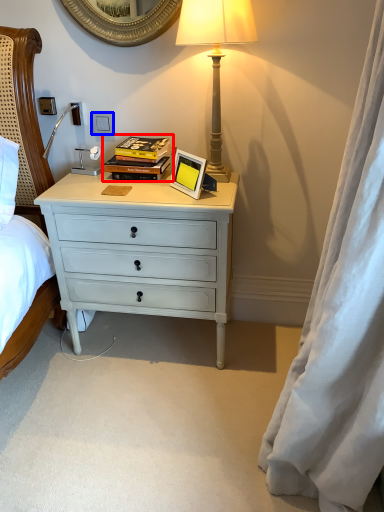
Question: Which object is further to the camera taking this photo, book (highlighted by a red box) or power outlet (highlighted by a blue box)?

Choices:
 (A) book
 (B) power outlet

Answer: (B)